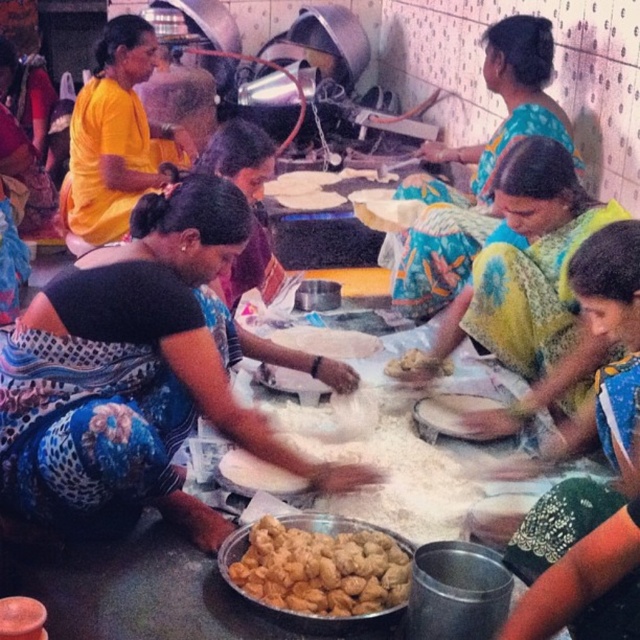
Can you confirm if yellow floral saree at center is taller than brown dough at center?

Indeed, yellow floral saree at center has a greater height compared to brown dough at center.

Is yellow floral saree at center positioned in front of brown dough at center?

Yes, yellow floral saree at center is in front of brown dough at center.

Who is more distant from viewer, (493,419) or (428,365)?

Positioned behind is point (428,365).

I want to click on yellow floral saree at center, so click(531, 288).

Is blue printed saree at center taller than yellow floral saree at center?

Yes.

Looking at this image, who is shorter, blue printed saree at center or yellow floral saree at center?

yellow floral saree at center is shorter.

Describe the element at coordinates (140, 372) in the screenshot. The height and width of the screenshot is (640, 640). I see `blue printed saree at center` at that location.

Locate an element on the screen. This screenshot has height=640, width=640. blue printed saree at center is located at coordinates pos(140,372).

Does yellow floral saree at center have a smaller size compared to golden fried dough at center?

No, yellow floral saree at center is not smaller than golden fried dough at center.

Is point (552, 188) closer to viewer compared to point (390, 577)?

That is False.

Describe the element at coordinates (531, 288) in the screenshot. I see `yellow floral saree at center` at that location.

This screenshot has height=640, width=640. Identify the location of yellow floral saree at center. (531, 288).